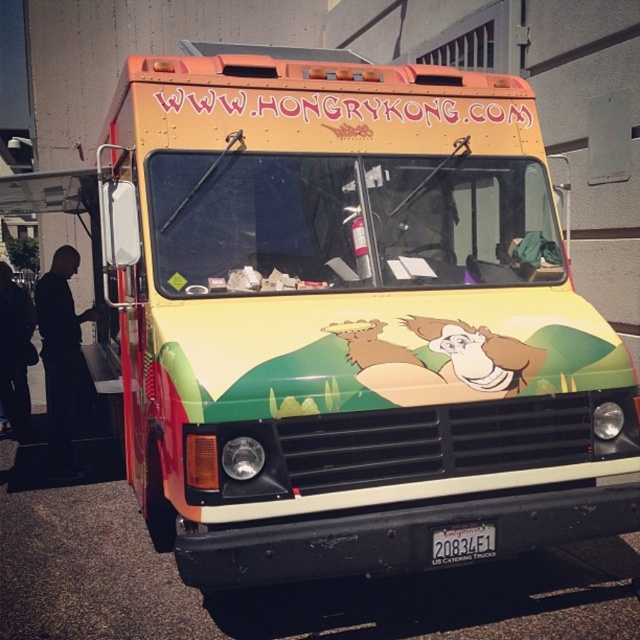
Does point (13, 403) lie in front of point (458, 541)?

That is False.

Find the location of a particular element. black fabric pants at left is located at coordinates (13, 352).

Who is more forward, (4, 301) or (464, 561)?

Point (464, 561)

Where is `black fabric pants at left`? The height and width of the screenshot is (640, 640). black fabric pants at left is located at coordinates (13, 352).

Does black matte clothing at left appear under white plastic license plate at center?

Actually, black matte clothing at left is above white plastic license plate at center.

You are a GUI agent. You are given a task and a screenshot of the screen. Output one action in this format:
    pyautogui.click(x=<x>, y=<y>)
    Task: Click on the black matte clothing at left
    The height and width of the screenshot is (640, 640).
    Given the screenshot: What is the action you would take?
    pyautogui.click(x=61, y=356)

Who is more distant from viewer, (74, 353) or (460, 552)?

The point (74, 353) is more distant.

Where is `black matte clothing at left`? The image size is (640, 640). black matte clothing at left is located at coordinates (61, 356).

Does black matte clothing at left appear on the right side of black fabric pants at left?

Indeed, black matte clothing at left is positioned on the right side of black fabric pants at left.

Is black matte clothing at left shorter than black fabric pants at left?

No, black matte clothing at left is not shorter than black fabric pants at left.

Image resolution: width=640 pixels, height=640 pixels. What are the coordinates of `black matte clothing at left` in the screenshot? It's located at (61, 356).

Find the location of a particular element. black matte clothing at left is located at coordinates (61, 356).